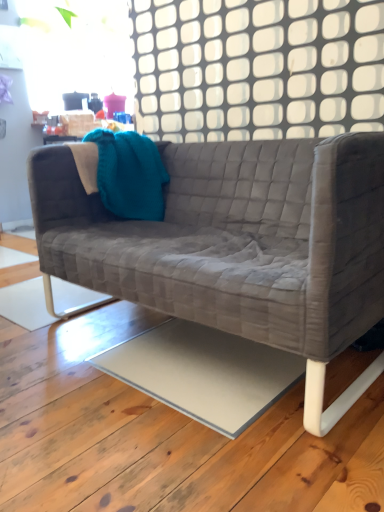
Question: Is velvet grey couch at center taller than white grid at upper center?

Choices:
 (A) no
 (B) yes

Answer: (B)

Question: Can you confirm if velvet grey couch at center is positioned to the left of white grid at upper center?

Choices:
 (A) yes
 (B) no

Answer: (A)

Question: From a real-world perspective, is velvet grey couch at center on white grid at upper center?

Choices:
 (A) yes
 (B) no

Answer: (B)

Question: From the image's perspective, does velvet grey couch at center appear lower than white grid at upper center?

Choices:
 (A) yes
 (B) no

Answer: (A)

Question: Is white grid at upper center at the back of velvet grey couch at center?

Choices:
 (A) yes
 (B) no

Answer: (B)

Question: Is white grid at upper center inside velvet grey couch at center?

Choices:
 (A) no
 (B) yes

Answer: (A)

Question: From the image's perspective, does velvet grey couch at center appear lower than teal knitted throw pillow at upper left?

Choices:
 (A) yes
 (B) no

Answer: (A)

Question: Is velvet grey couch at center positioned beyond the bounds of teal knitted throw pillow at upper left?

Choices:
 (A) yes
 (B) no

Answer: (A)

Question: Considering the relative positions of velvet grey couch at center and teal knitted throw pillow at upper left in the image provided, is velvet grey couch at center behind teal knitted throw pillow at upper left?

Choices:
 (A) no
 (B) yes

Answer: (A)

Question: Is teal knitted throw pillow at upper left a part of velvet grey couch at center?

Choices:
 (A) no
 (B) yes

Answer: (B)

Question: Considering the relative positions of velvet grey couch at center and teal knitted throw pillow at upper left in the image provided, is velvet grey couch at center to the right of teal knitted throw pillow at upper left from the viewer's perspective?

Choices:
 (A) no
 (B) yes

Answer: (B)

Question: Is velvet grey couch at center aimed at teal knitted throw pillow at upper left?

Choices:
 (A) no
 (B) yes

Answer: (A)

Question: From a real-world perspective, is teal knitted throw pillow at upper left located beneath white grid at upper center?

Choices:
 (A) yes
 (B) no

Answer: (A)